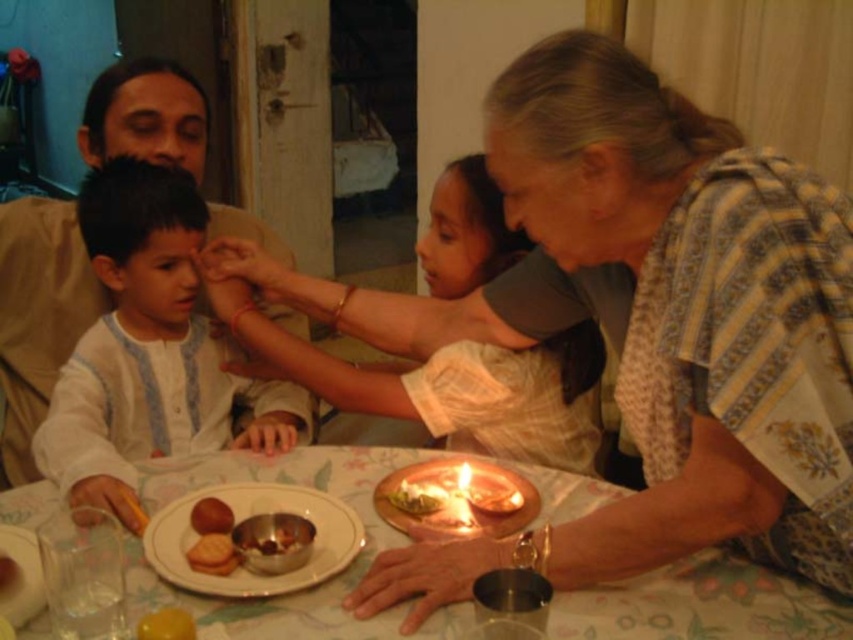
You are a guest at this family gathering and want to eat the smooth brown bread at center. However, the shiny brass plate at center is blocking your access. Can you reach the bread without moving the plate?

The shiny brass plate at center is positioned over smooth brown bread at center, so you cannot reach the bread without moving the plate.

You are a chef preparing to serve a dish and need to place a shiny brass plate at center and a smooth brown bread at center on the table. The table is 14 inches wide. Can both items fit side by side without overlapping?

The distance between the shiny brass plate at center and smooth brown bread at center is 12.09 inches. Since the table is 14 inches wide, there is enough space to place both items side by side without overlapping.